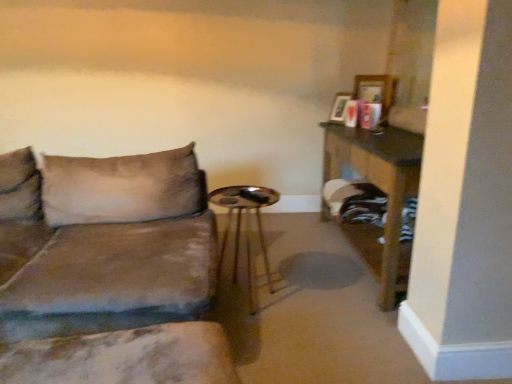
Question: Is velvet brown couch at left placed right next to marble-patterned cushion at lower left?

Choices:
 (A) no
 (B) yes

Answer: (A)

Question: Can you confirm if velvet brown couch at left is wider than marble-patterned cushion at lower left?

Choices:
 (A) yes
 (B) no

Answer: (A)

Question: Is velvet brown couch at left positioned before marble-patterned cushion at lower left?

Choices:
 (A) no
 (B) yes

Answer: (B)

Question: Is velvet brown couch at left looking in the opposite direction of marble-patterned cushion at lower left?

Choices:
 (A) no
 (B) yes

Answer: (A)

Question: Would you say velvet brown couch at left is outside marble-patterned cushion at lower left?

Choices:
 (A) yes
 (B) no

Answer: (A)

Question: Does point (242, 193) appear closer or farther from the camera than point (369, 165)?

Choices:
 (A) closer
 (B) farther

Answer: (B)

Question: Choose the correct answer: Is metallic gold side table at center inside wooden table at right or outside it?

Choices:
 (A) outside
 (B) inside

Answer: (A)

Question: Looking at their shapes, would you say metallic gold side table at center is wider or thinner than wooden table at right?

Choices:
 (A) wide
 (B) thin

Answer: (B)

Question: From the image's perspective, is metallic gold side table at center located above or below wooden table at right?

Choices:
 (A) above
 (B) below

Answer: (B)

Question: From a real-world perspective, is marble-patterned cushion at lower left positioned above or below wooden table at right?

Choices:
 (A) below
 (B) above

Answer: (A)

Question: Is point (69, 382) closer or farther from the camera than point (373, 152)?

Choices:
 (A) farther
 (B) closer

Answer: (B)

Question: Would you say marble-patterned cushion at lower left is to the left or to the right of wooden table at right in the picture?

Choices:
 (A) right
 (B) left

Answer: (B)

Question: Considering the positions of marble-patterned cushion at lower left and wooden table at right in the image, is marble-patterned cushion at lower left wider or thinner than wooden table at right?

Choices:
 (A) thin
 (B) wide

Answer: (B)

Question: Is metallic gold side table at center spatially inside velvet brown couch at left, or outside of it?

Choices:
 (A) inside
 (B) outside

Answer: (B)

Question: Is point (251, 309) closer or farther from the camera than point (209, 326)?

Choices:
 (A) farther
 (B) closer

Answer: (A)